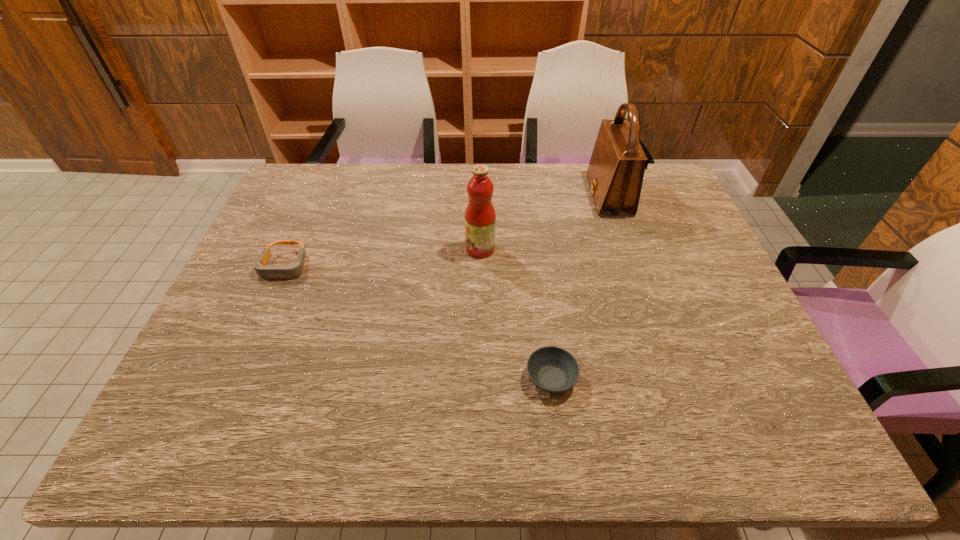
Find the location of `free space located 0.240m on the front label of the second tallest object`. free space located 0.240m on the front label of the second tallest object is located at coordinates (382, 249).

Find the location of a particular element. This screenshot has width=960, height=540. free space located on the front label of the second tallest object is located at coordinates (448, 249).

The height and width of the screenshot is (540, 960). In order to click on vacant space located on the front label of the second tallest object in this screenshot , I will do `click(374, 249)`.

In order to click on vacant space located on the front and back of the goggles in this screenshot , I will do `click(235, 379)`.

You are a GUI agent. You are given a task and a screenshot of the screen. Output one action in this format:
    pyautogui.click(x=<x>, y=<y>)
    Task: Click on the vacant space located on the right of the soup bowl
    The width and height of the screenshot is (960, 540).
    Given the screenshot: What is the action you would take?
    pyautogui.click(x=704, y=379)

Where is `object at the far edge`? This screenshot has width=960, height=540. object at the far edge is located at coordinates (615, 174).

The height and width of the screenshot is (540, 960). I want to click on object that is at the left edge, so click(294, 270).

The height and width of the screenshot is (540, 960). In the image, there is a desktop. Identify the location of vacant space at the far edge. (x=362, y=205).

I want to click on vacant space at the near edge of the desktop, so click(x=681, y=413).

In the image, there is a desktop. What are the coordinates of `vacant space at the left edge` in the screenshot? It's located at (297, 207).